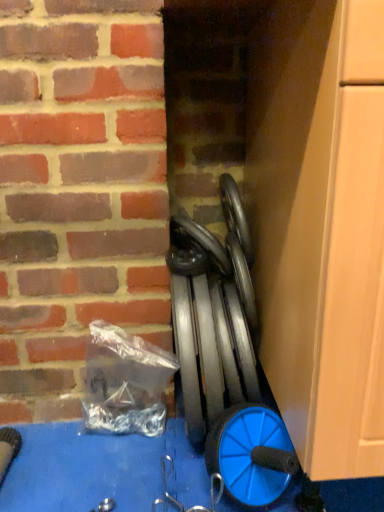
Question: Is blue plastic wheel at lower right at the back of black rubber car tire at center?

Choices:
 (A) no
 (B) yes

Answer: (A)

Question: Could you tell me if black rubber car tire at center is turned towards blue plastic wheel at lower right?

Choices:
 (A) yes
 (B) no

Answer: (B)

Question: Is black rubber car tire at center completely or partially outside of blue plastic wheel at lower right?

Choices:
 (A) yes
 (B) no

Answer: (A)

Question: Considering the relative sizes of black rubber car tire at center and blue plastic wheel at lower right in the image provided, is black rubber car tire at center thinner than blue plastic wheel at lower right?

Choices:
 (A) yes
 (B) no

Answer: (B)

Question: Is black rubber car tire at center wider than blue plastic wheel at lower right?

Choices:
 (A) no
 (B) yes

Answer: (B)

Question: From the image's perspective, is black rubber car tire at center located above or below metallic gray weights at center?

Choices:
 (A) below
 (B) above

Answer: (B)

Question: Considering the positions of black rubber car tire at center and metallic gray weights at center in the image, is black rubber car tire at center bigger or smaller than metallic gray weights at center?

Choices:
 (A) small
 (B) big

Answer: (A)

Question: Is black rubber car tire at center inside or outside of metallic gray weights at center?

Choices:
 (A) outside
 (B) inside

Answer: (A)

Question: Considering their positions, is black rubber car tire at center located in front of or behind metallic gray weights at center?

Choices:
 (A) front
 (B) behind

Answer: (B)

Question: Considering the positions of point (185, 304) and point (230, 270), is point (185, 304) closer or farther from the camera than point (230, 270)?

Choices:
 (A) closer
 (B) farther

Answer: (A)

Question: Based on their sizes in the image, would you say metallic gray weights at center is bigger or smaller than black rubber car tire at center?

Choices:
 (A) small
 (B) big

Answer: (B)

Question: From a real-world perspective, is metallic gray weights at center physically located above or below black rubber car tire at center?

Choices:
 (A) below
 (B) above

Answer: (A)

Question: Considering the positions of metallic gray weights at center and black rubber car tire at center in the image, is metallic gray weights at center wider or thinner than black rubber car tire at center?

Choices:
 (A) thin
 (B) wide

Answer: (B)

Question: Is point (226, 435) positioned closer to the camera than point (195, 222)?

Choices:
 (A) farther
 (B) closer

Answer: (B)

Question: Is blue plastic wheel at lower right taller or shorter than black rubber car tire at center?

Choices:
 (A) tall
 (B) short

Answer: (A)